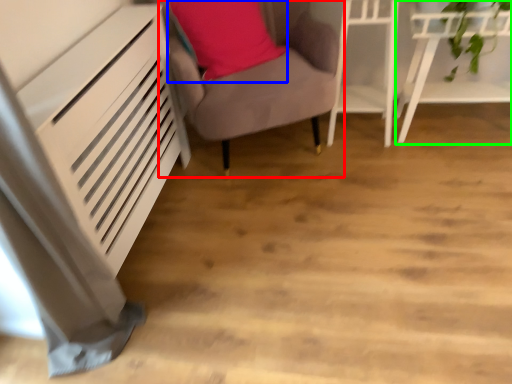
Question: Which object is positioned farthest from furniture (highlighted by a red box)? Select from pillow (highlighted by a blue box) and furniture (highlighted by a green box).

Choices:
 (A) pillow
 (B) furniture

Answer: (B)